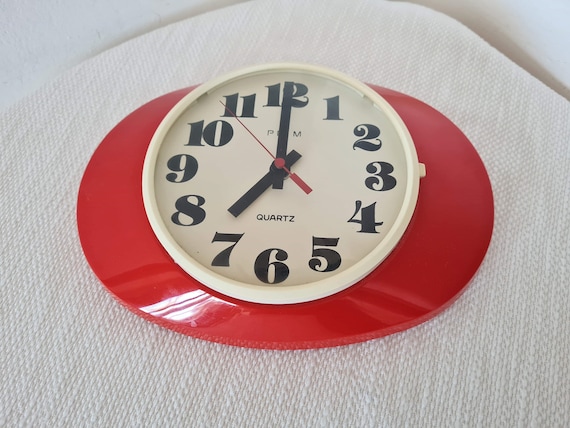
In order to click on "7" on clock face in this screenshot , I will do `click(222, 259)`.